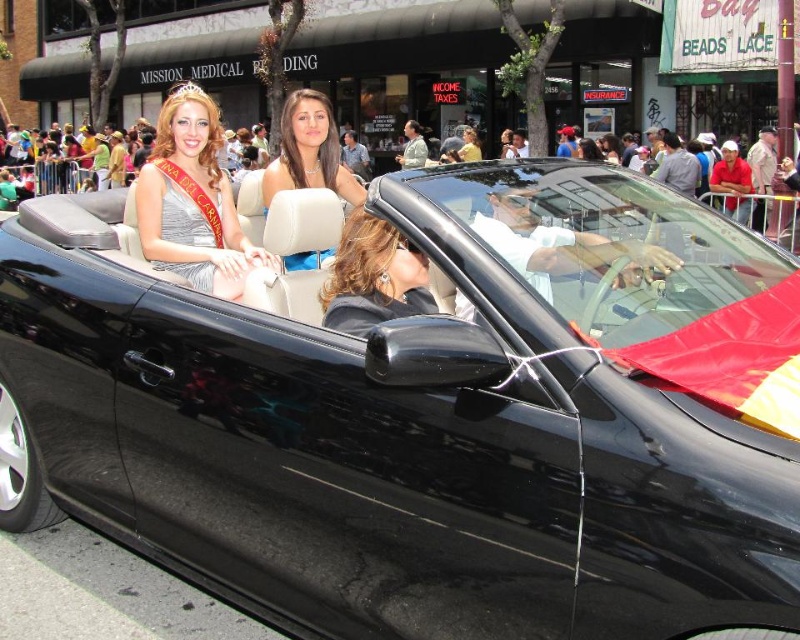
You are standing on the sidewalk watching the parade. You notice two points marked on the car. The first point is at coordinates point (204, 131) and the second is at point (378, 268). Which point is closer to you?

Point (204, 131) is closer to you because it is further to the viewer than point (378, 268).

You are a photographer trying to capture a clear shot of the two women in the car. The car is moving slowly, and you can only take a photo if both the satin silver dress at upper left and the shiny black hair at center are fully visible. Based on their positions, can you take the photo now?

The shiny black hair at center is behind the satin silver dress at upper left, so taking a photo now might result in the shiny black hair at center being obscured by the satin silver dress at upper left. Wait for the car to adjust positions for a clearer view.